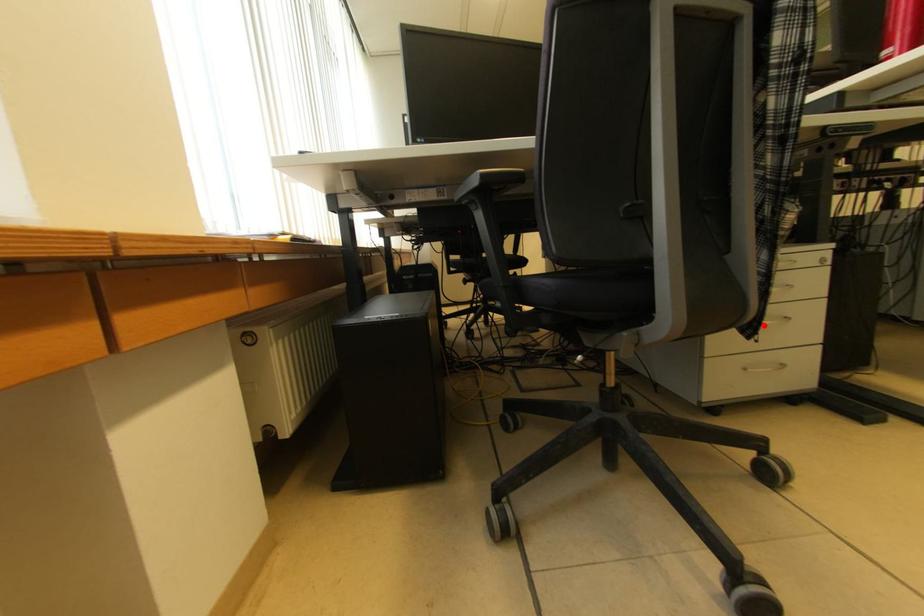
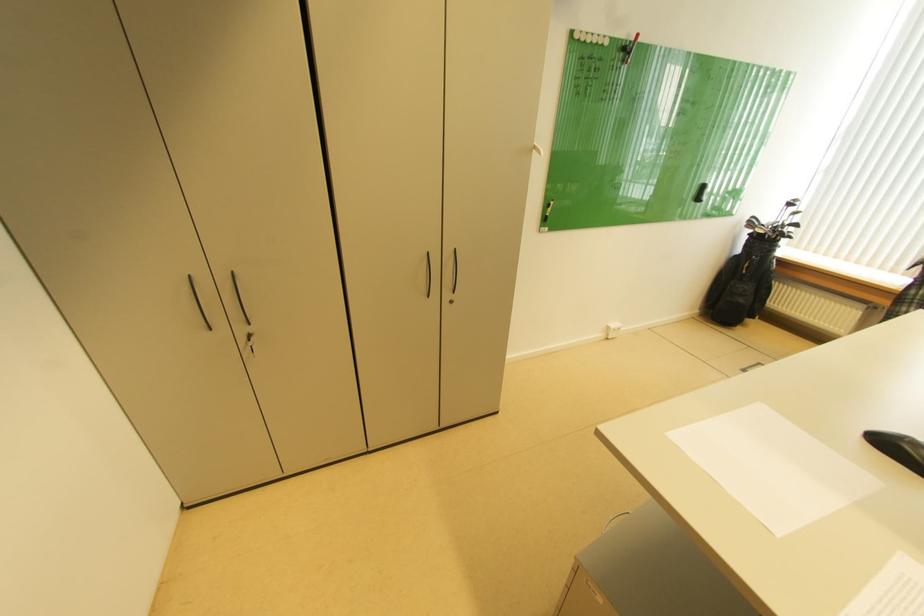
Question: I am providing you with two images of the same scene from different viewpoints. A red point is marked on the first image. Can you still see the location of the red point in image 2?

Choices:
 (A) Yes
 (B) No

Answer: (B)